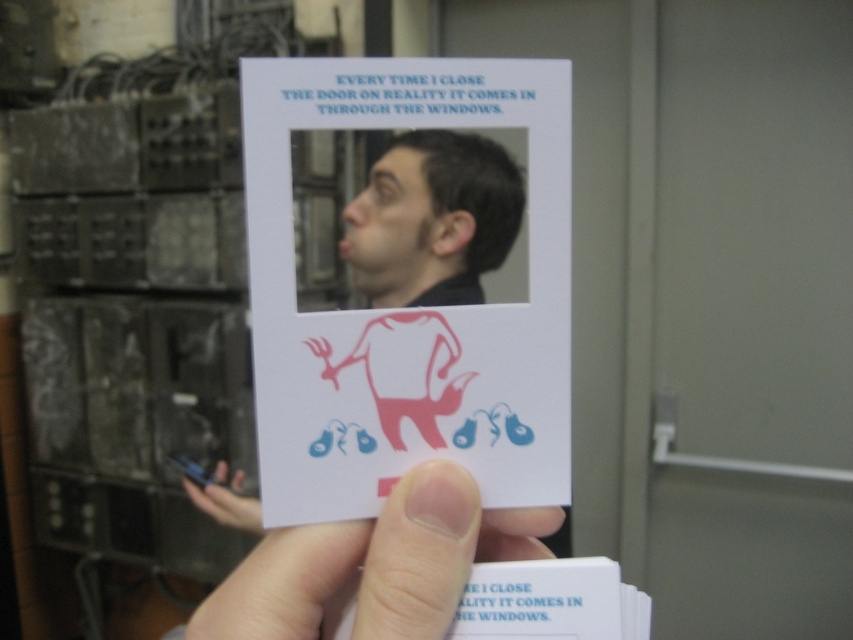
Question: Considering the real-world distances, which object is closest to the matte black hair at upper center?

Choices:
 (A) white paper card at center
 (B) flesh-toned skin at lower center

Answer: (A)

Question: Which point is farther to the camera?

Choices:
 (A) matte black hair at upper center
 (B) white paper card at center

Answer: (A)

Question: Does flesh-toned skin at lower center have a greater width compared to matte black hair at upper center?

Choices:
 (A) no
 (B) yes

Answer: (B)

Question: Estimate the real-world distances between objects in this image. Which object is closer to the flesh-toned skin at lower center?

Choices:
 (A) matte black hair at upper center
 (B) white paper card at center

Answer: (B)

Question: Is white paper card at center closer to camera compared to flesh-toned skin at lower center?

Choices:
 (A) no
 (B) yes

Answer: (A)

Question: Where is white paper card at center located in relation to matte black hair at upper center in the image?

Choices:
 (A) below
 (B) above

Answer: (A)